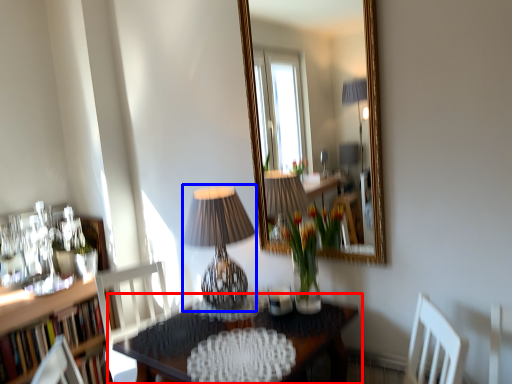
Question: Among these objects, which one is farthest to the camera, table (highlighted by a red box) or table lamp (highlighted by a blue box)?

Choices:
 (A) table
 (B) table lamp

Answer: (B)